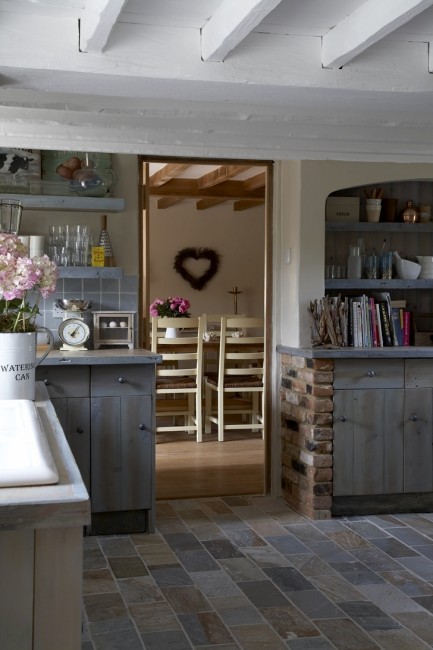
Image resolution: width=433 pixels, height=650 pixels. Identify the location of box. (345, 205).